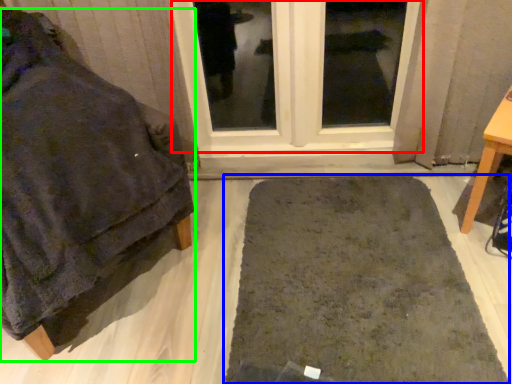
Question: Which object is the farthest from window (highlighted by a red box)? Choose among these: bath mat (highlighted by a blue box) or furniture (highlighted by a green box).

Choices:
 (A) bath mat
 (B) furniture

Answer: (B)